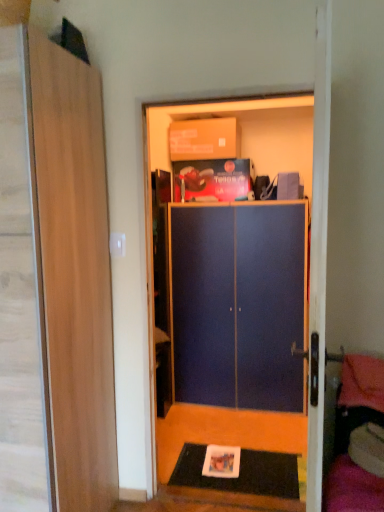
Question: In terms of size, does black rubber doormat at lower center appear bigger or smaller than blue matte cabinet at center?

Choices:
 (A) small
 (B) big

Answer: (A)

Question: Considering the positions of point (238, 487) and point (155, 129), is point (238, 487) closer or farther from the camera than point (155, 129)?

Choices:
 (A) farther
 (B) closer

Answer: (B)

Question: Estimate the real-world distances between objects in this image. Which object is closer to the wooden door at left?

Choices:
 (A) matte cardboard box at upper center
 (B) black rubber doormat at lower center
 (C) blue matte cabinet at center
 (D) blue matte cabinet at center

Answer: (B)

Question: Which is nearer to the black rubber doormat at lower center?

Choices:
 (A) matte cardboard box at upper center
 (B) blue matte cabinet at center
 (C) blue matte cabinet at center
 (D) wooden door at left

Answer: (C)